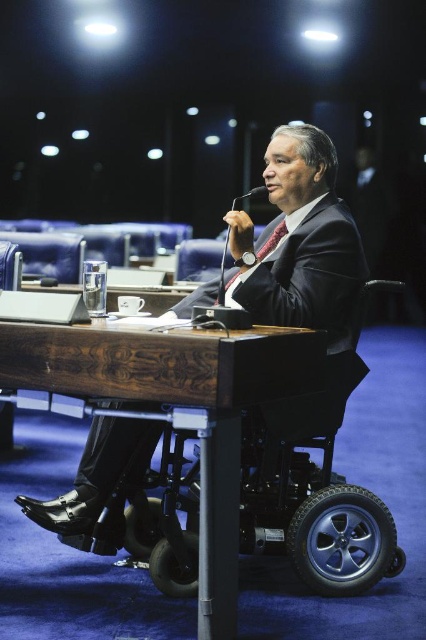
Consider the image. You are a visitor in the chamber and need to place a small gift on the wooden table at center. According to the coordinates provided, where exactly should you place the gift on the table?

The wooden table at center is located at coordinates point (178, 410), so you should place the gift there.

You are a stagehand setting up for a presentation. The wooden table at center needs to be positioned exactly 4 meters away from the black plastic microphone at center. Based on the scene, is the current placement correct?

The wooden table at center is 4.08 meters from the black plastic microphone at center, which is slightly over the required 4 meters. The current placement is not exactly correct as it exceeds the specified distance by 0.08 meters.

You are a photographer standing at the camera position. You need to place a small tripod to capture a closeup of the wooden table at center. The tripod requires at least 1 meter of space between itself and the table to set up. Do you have enough space to set up the tripod?

The wooden table at center is 1.52 meters from the camera. Since the tripod needs at least 1 meter of space, there is sufficient distance to set it up.